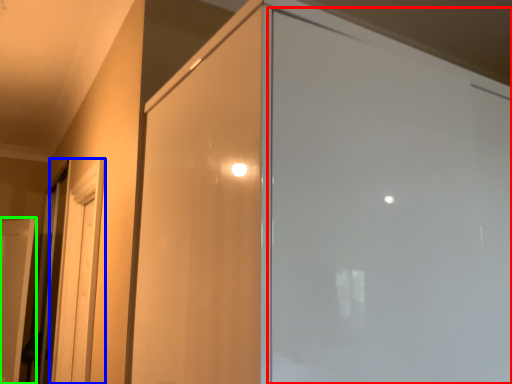
Question: Which object is positioned closest to screen door (highlighted by a red box)? Select from screen door (highlighted by a blue box) and door (highlighted by a green box).

Choices:
 (A) screen door
 (B) door

Answer: (A)